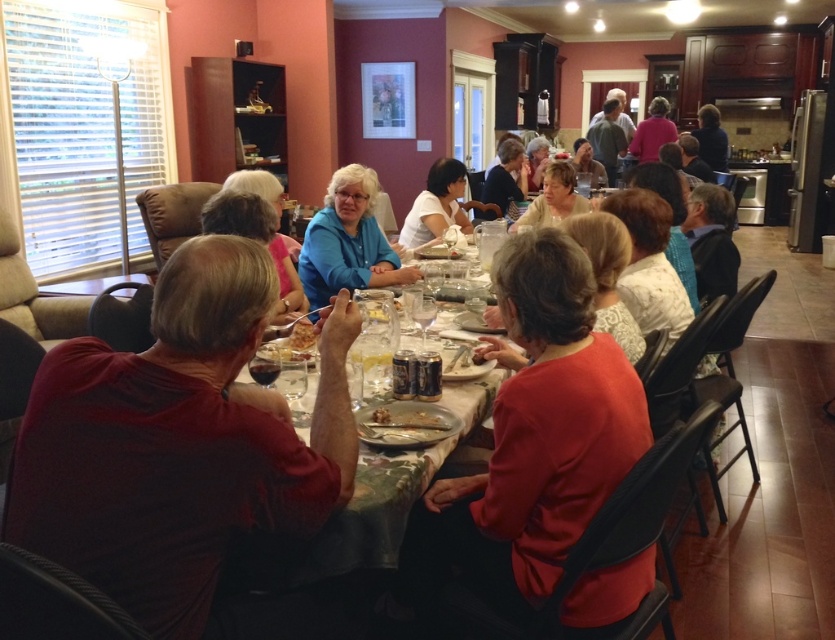
Does matte blue shirt at center appear on the left side of smooth brown bread at center?

Incorrect, matte blue shirt at center is not on the left side of smooth brown bread at center.

Does point (554, 225) lie behind point (375, 408)?

Yes, it is.

Where is `matte blue shirt at center`? matte blue shirt at center is located at coordinates point(553,198).

Is green fabric table at center smaller than white matte shirt at center?

Yes.

Which is below, green fabric table at center or white matte shirt at center?

Positioned lower is green fabric table at center.

Between point (261, 560) and point (406, 221), which one is positioned in front?

Point (261, 560) is in front.

The height and width of the screenshot is (640, 835). In order to click on green fabric table at center in this screenshot , I will do `click(342, 525)`.

Can you confirm if dark red shirt at left is smaller than matte red shirt at center?

Yes, dark red shirt at left is smaller than matte red shirt at center.

Is dark red shirt at left taller than matte red shirt at center?

Incorrect, dark red shirt at left's height is not larger of matte red shirt at center's.

I want to click on dark red shirt at left, so click(x=176, y=442).